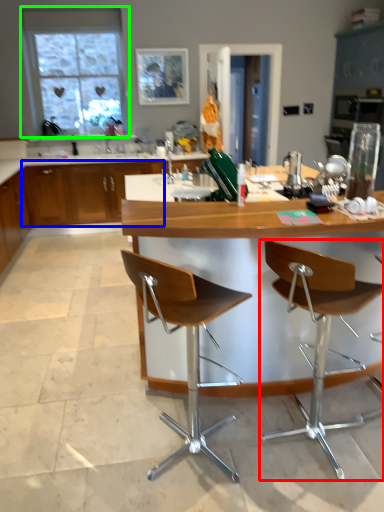
Question: Considering the real-world distances, which object is farthest from chair (highlighted by a red box)? cabinetry (highlighted by a blue box) or window (highlighted by a green box)?

Choices:
 (A) cabinetry
 (B) window

Answer: (B)